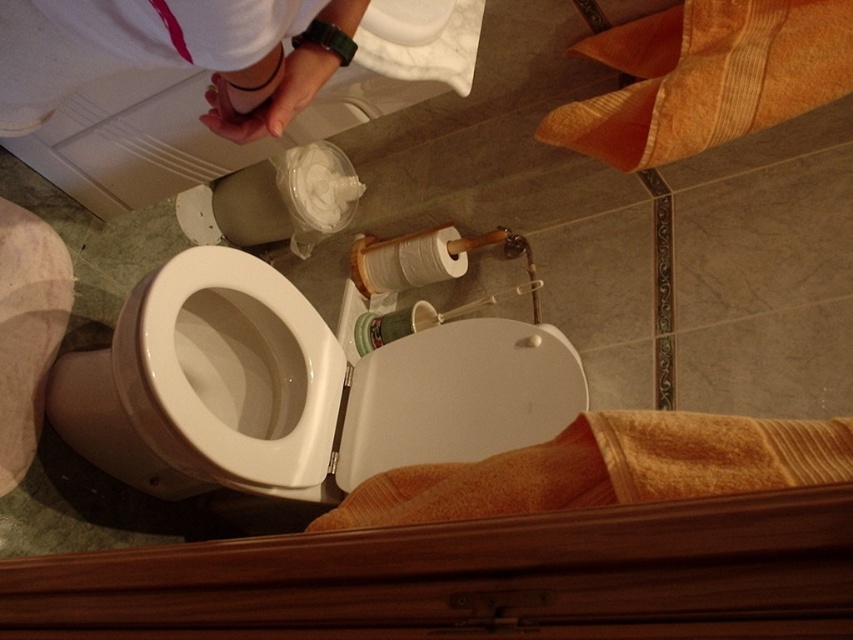
You are a bathroom cleaner who needs to reach the white glossy toilet lid at center to disinfect it. However, you are currently standing behind the white matte toilet paper at center. Can you directly access the toilet lid without moving the toilet paper?

The white glossy toilet lid at center is positioned under the white matte toilet paper at center, so you cannot directly access the toilet lid without moving the toilet paper.

You are a housekeeper inspecting the bathroom. You see the white glossy toilet bowl at center and the green plastic cup at center. Which object is positioned lower in the scene?

The white glossy toilet bowl at center is positioned below the green plastic cup at center, so it is lower in the scene.

You are a maintenance worker inspecting a bathroom. You notice the white fabric at upper left and the white matte toilet paper at center. Which object is located to the left of the other?

The white fabric at upper left is positioned on the left side of white matte toilet paper at center.